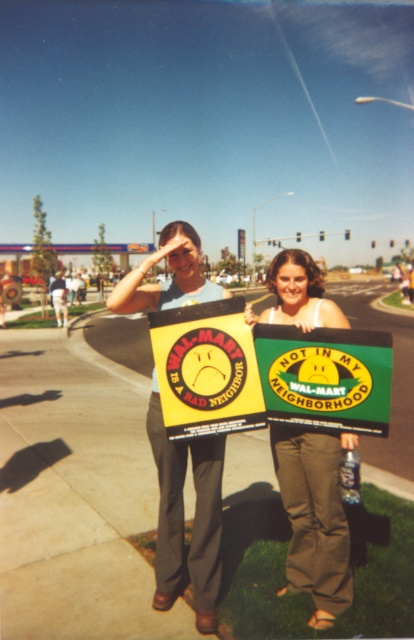
Does green fabric sign at center have a lesser height compared to yellow matte sign at center?

Yes.

Is point (358, 333) farther from viewer compared to point (182, 396)?

Yes.

In order to click on green fabric sign at center in this screenshot , I will do `click(325, 378)`.

The image size is (414, 640). I want to click on yellow matte sign at center, so click(x=207, y=369).

Which is more to the left, yellow matte sign at center or light brown leather jacket at center?

light brown leather jacket at center is more to the left.

Which is in front, point (156, 337) or point (60, 291)?

Positioned in front is point (156, 337).

Image resolution: width=414 pixels, height=640 pixels. Find the location of `yellow matte sign at center`. yellow matte sign at center is located at coordinates (207, 369).

Which is more to the left, green cotton tank top at center or light brown leather jacket at center?

Positioned to the left is light brown leather jacket at center.

Which is behind, point (331, 604) or point (60, 296)?

Positioned behind is point (60, 296).

In order to click on green cotton tank top at center in this screenshot , I will do pyautogui.click(x=315, y=516).